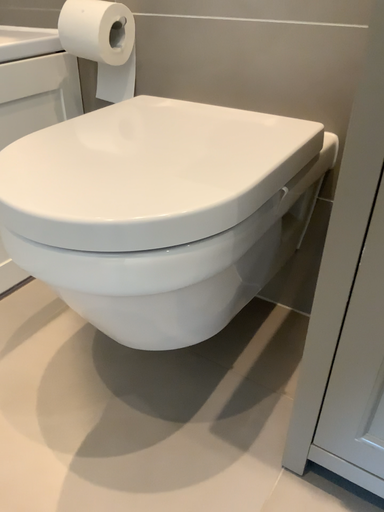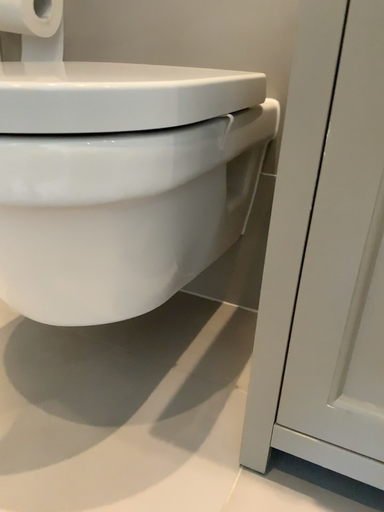
Question: Which way did the camera rotate in the video?

Choices:
 (A) rotated left
 (B) rotated right

Answer: (B)